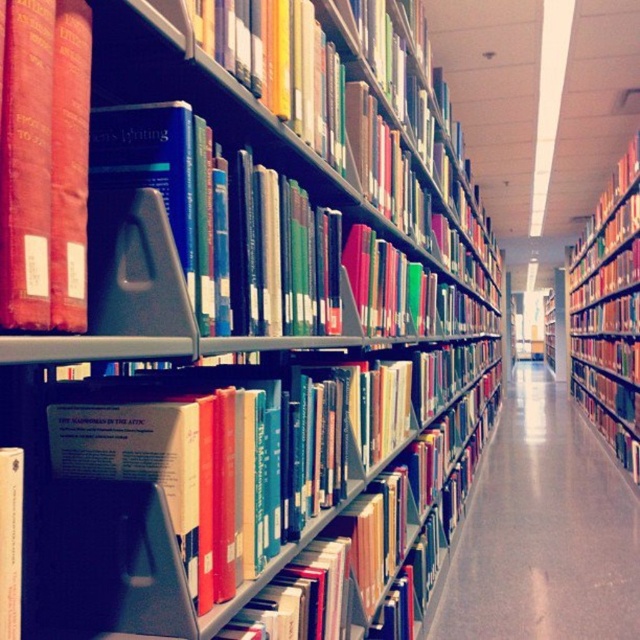
You are a librarian organizing books in the library. You have a hardcover book at center that needs to be placed on the red matte bookcase at right. Can you reach the bookcase from your current position?

The red matte bookcase at right is located above the hardcover book at center, so you can reach it by moving the hardcover book at center out of the way and accessing the bookcase above.

You are organizing books in a library and need to place a new book on the tallest object available. Which object should you choose between the red matte bookcase at right and the hardcover book at center?

The red matte bookcase at right has a greater height compared to the hardcover book at center, so you should place the new book on the red matte bookcase at right.